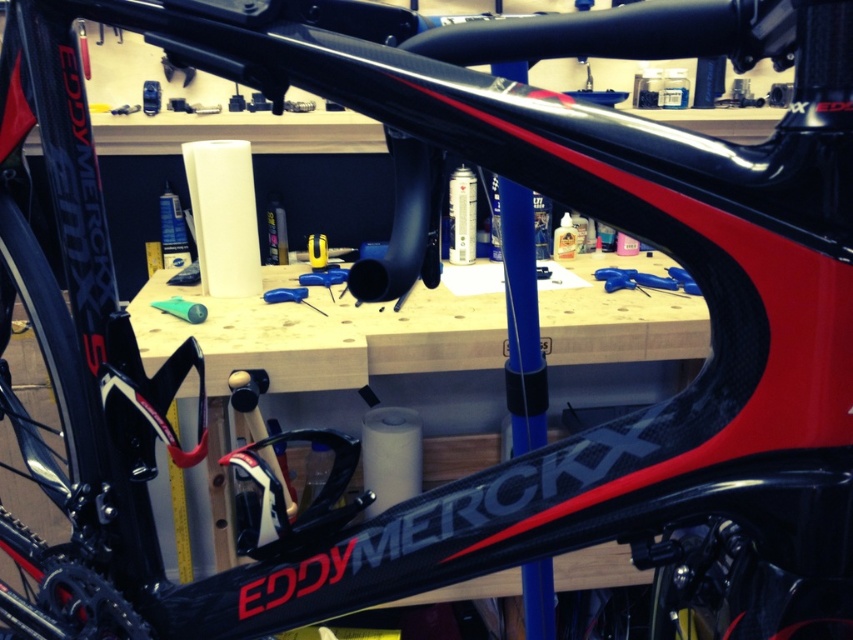
Which is behind, point (57, 634) or point (657, 285)?

The point (657, 285) is behind.

Does black rubber tire at lower left have a greater height compared to blue rubber handlebar tape at center?

Yes, black rubber tire at lower left is taller than blue rubber handlebar tape at center.

Image resolution: width=853 pixels, height=640 pixels. Find the location of `black rubber tire at lower left`. black rubber tire at lower left is located at coordinates (56, 467).

Does blue rubber handlebar tape at center have a larger size compared to green rubber tube at center?

Yes, blue rubber handlebar tape at center is bigger than green rubber tube at center.

Is blue rubber handlebar tape at center smaller than green rubber tube at center?

Incorrect, blue rubber handlebar tape at center is not smaller in size than green rubber tube at center.

Based on the photo, who is more forward, (x=614, y=276) or (x=151, y=305)?

Positioned in front is point (x=151, y=305).

I want to click on blue rubber handlebar tape at center, so click(x=645, y=280).

Is point (82, 445) positioned in front of point (170, 307)?

Yes, point (82, 445) is closer to viewer.

Does black rubber tire at lower left appear on the right side of green rubber tube at center?

No, black rubber tire at lower left is not to the right of green rubber tube at center.

Locate an element on the screen. The image size is (853, 640). black rubber tire at lower left is located at coordinates (56, 467).